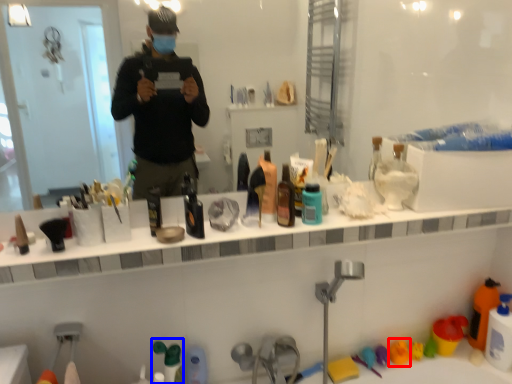
Question: Which object appears closest to the camera in this image, toy (highlighted by a red box) or toiletry (highlighted by a blue box)?

Choices:
 (A) toy
 (B) toiletry

Answer: (B)